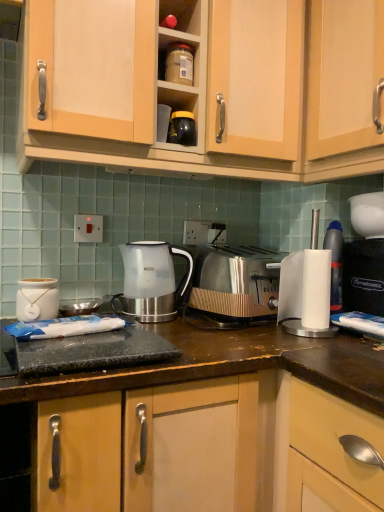
Question: From a real-world perspective, is light wood cabinet at upper right, which appears as the first cabinetry when viewed from the right, above or below black plastic bag at right?

Choices:
 (A) above
 (B) below

Answer: (A)

Question: Considering the positions of point (344, 10) and point (365, 252), is point (344, 10) closer or farther from the camera than point (365, 252)?

Choices:
 (A) farther
 (B) closer

Answer: (B)

Question: Which object is positioned closest to the wooden cabinet at upper center, the 1th cabinetry in the left-to-right sequence?

Choices:
 (A) translucent plastic kettle at center
 (B) white ceramic jar at left
 (C) white plastic bottle at right
 (D) black plastic bag at right
 (E) matte plastic container at upper center, arranged as the first appliance when viewed from the top

Answer: (E)

Question: Estimate the real-world distances between objects in this image. Which object is farther from the black plastic bag at right?

Choices:
 (A) white plastic bottle at right
 (B) translucent plastic kettle at center
 (C) white ceramic jar at left
 (D) light wood cabinet at upper right, arranged as the second cabinetry when viewed from the left
 (E) satin metallic toaster at center

Answer: (C)